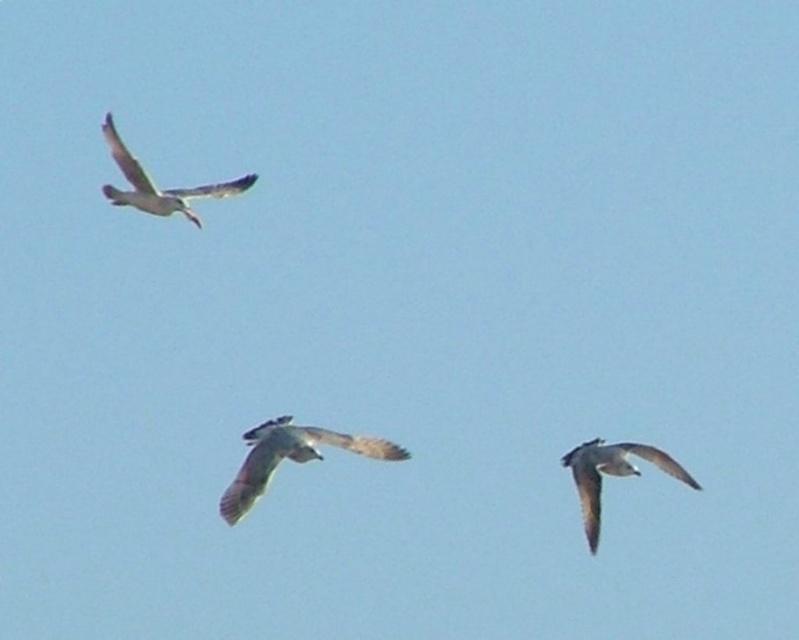
You are a birdwatcher trying to identify the birds in the sky. You notice two birds, the light brown feathered bird at center and the gray feathered bird at lower right. Which bird do you think is bigger?

The light brown feathered bird at center is larger in size compared to the gray feathered bird at lower right.

You are a birdwatcher observing three birds in flight. You notice a light brown feathered bird at center at point (289, 458). Can you confirm if this bird is exactly at the center of the image?

The light brown feathered bird at center is located at point (289, 458), which is the exact center of the image.

You are a birdwatcher trying to capture both the light brown feathered bird at center and the speckled feathered bird at upper left in a single photo. Your camera has a lens that can focus on objects up to 15 meters apart. Can you fit both birds into the frame?

The light brown feathered bird at center and the speckled feathered bird at upper left are 13.78 meters apart, so yes, the camera lens can focus on objects up to 15 meters apart, allowing both birds to be captured in the frame.